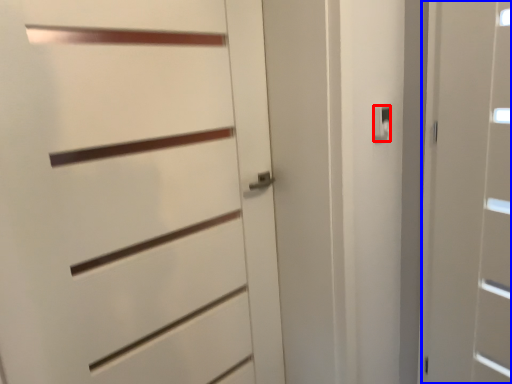
Question: Which object is closer to the camera taking this photo, latch (highlighted by a red box) or door (highlighted by a blue box)?

Choices:
 (A) latch
 (B) door

Answer: (B)